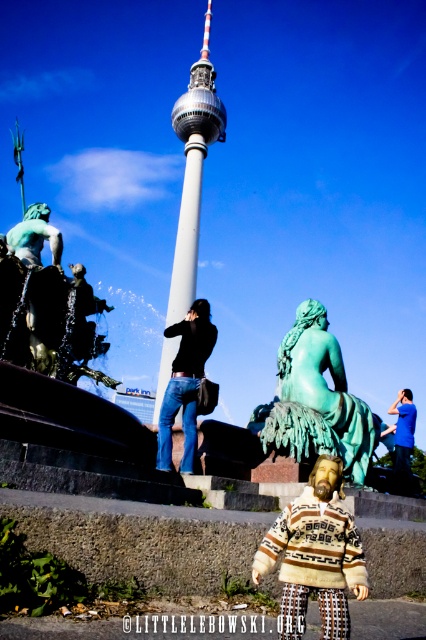
What is located at the coordinates point (316, 400) in the image?

The point (316, 400) corresponds to the green patina statue at center.

You are a photographer trying to capture both the white smooth tower at center and the black matte jacket at center in a single frame. Which object should you focus on first to ensure both are in the frame?

The white smooth tower at center is taller than the black matte jacket at center. To ensure both are in the frame, focus on the taller white smooth tower at center first, then adjust the camera angle to include the shorter black matte jacket at center.